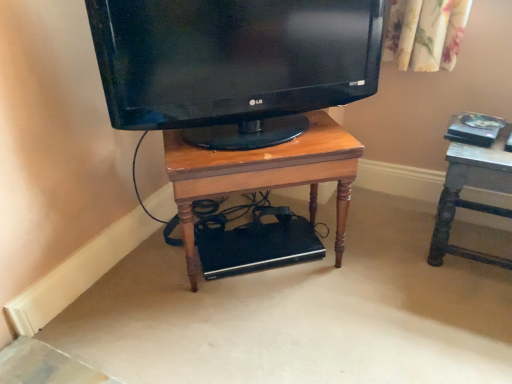
You are a GUI agent. You are given a task and a screenshot of the screen. Output one action in this format:
    pyautogui.click(x=<x>, y=<y>)
    Task: Click on the vacant area that is in front of wooden desk at center
    Image resolution: width=512 pixels, height=384 pixels.
    Given the screenshot: What is the action you would take?
    pyautogui.click(x=264, y=329)